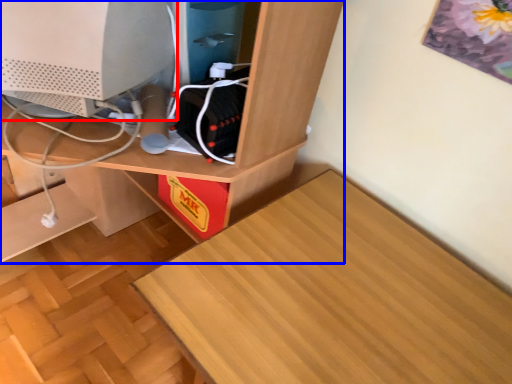
Question: Which object is further to the camera taking this photo, computer monitor (highlighted by a red box) or desk (highlighted by a blue box)?

Choices:
 (A) computer monitor
 (B) desk

Answer: (A)